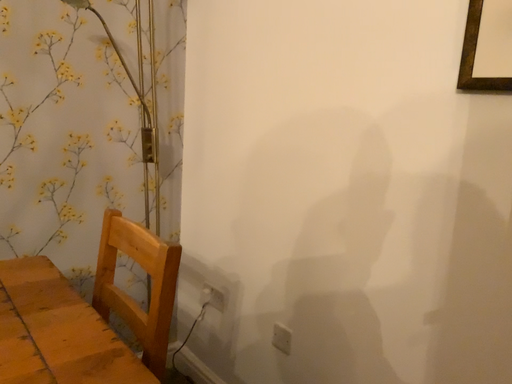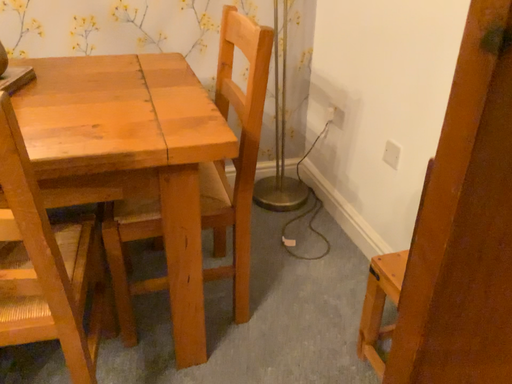
Question: Which way did the camera rotate in the video?

Choices:
 (A) rotated downward
 (B) rotated upward

Answer: (A)